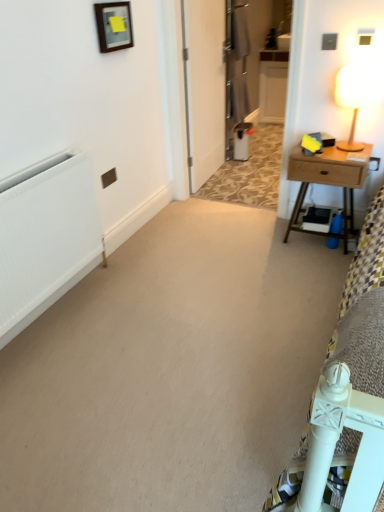
This screenshot has height=512, width=384. What are the coordinates of `free space underneath white matte radiator at left (from a real-world perspective)` in the screenshot? It's located at coord(67,304).